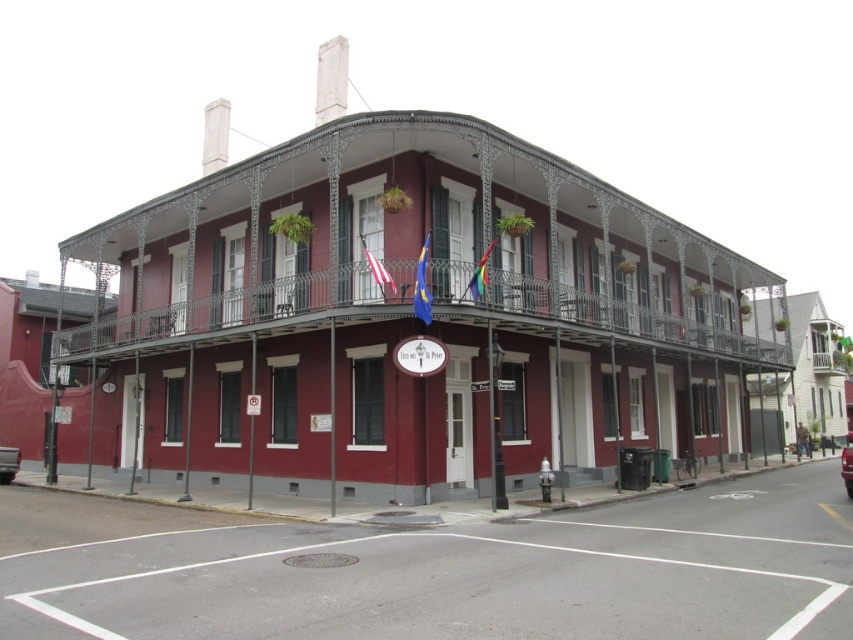
Question: Is white wood sign at center further to the viewer compared to metallic silver truck at lower left?

Choices:
 (A) yes
 (B) no

Answer: (B)

Question: Which is nearer to the rainbow fabric flag at upper center?

Choices:
 (A) metallic wrought iron balcony at center
 (B) blue fabric flag at center
 (C) shiny red car at center
 (D) metallic silver truck at lower left

Answer: (B)

Question: Can you confirm if white wood sign at center is positioned to the right of metallic silver truck at lower left?

Choices:
 (A) yes
 (B) no

Answer: (A)

Question: Is white wood sign at center behind shiny red car at center?

Choices:
 (A) yes
 (B) no

Answer: (B)

Question: Among these objects, which one is farthest from the camera?

Choices:
 (A) blue fabric flag at center
 (B) metallic silver truck at lower left
 (C) metallic wrought iron balcony at center
 (D) white wood sign at center

Answer: (B)

Question: Among these objects, which one is farthest from the camera?

Choices:
 (A) metallic wrought iron balcony at center
 (B) white fabric flag at center

Answer: (A)